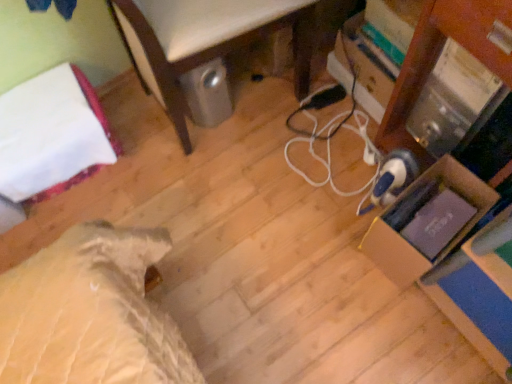
You are a GUI agent. You are given a task and a screenshot of the screen. Output one action in this format:
    pyautogui.click(x=<x>, y=<y>)
    Task: Click on the space that is in front of white cord at center
    This screenshot has width=512, height=384.
    Given the screenshot: What is the action you would take?
    pyautogui.click(x=318, y=240)